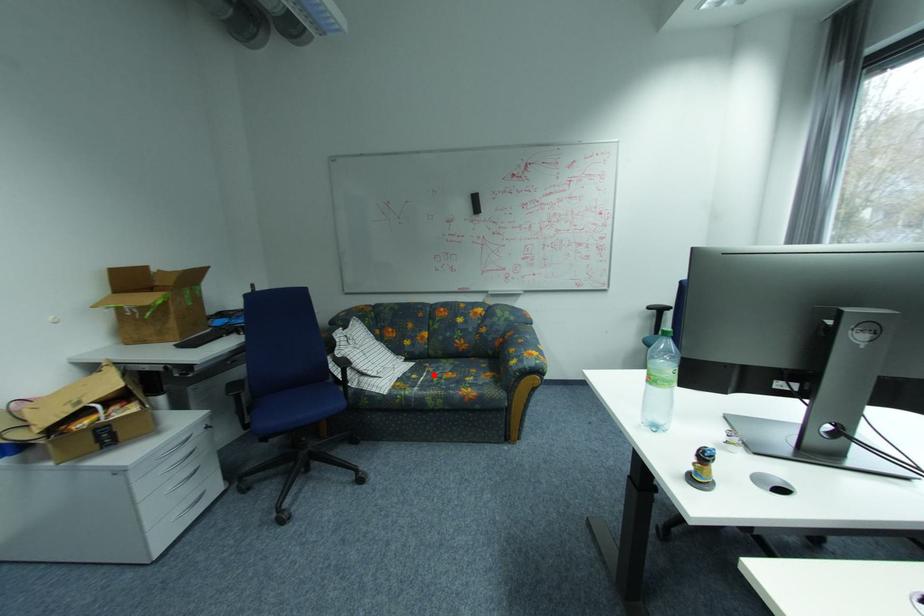
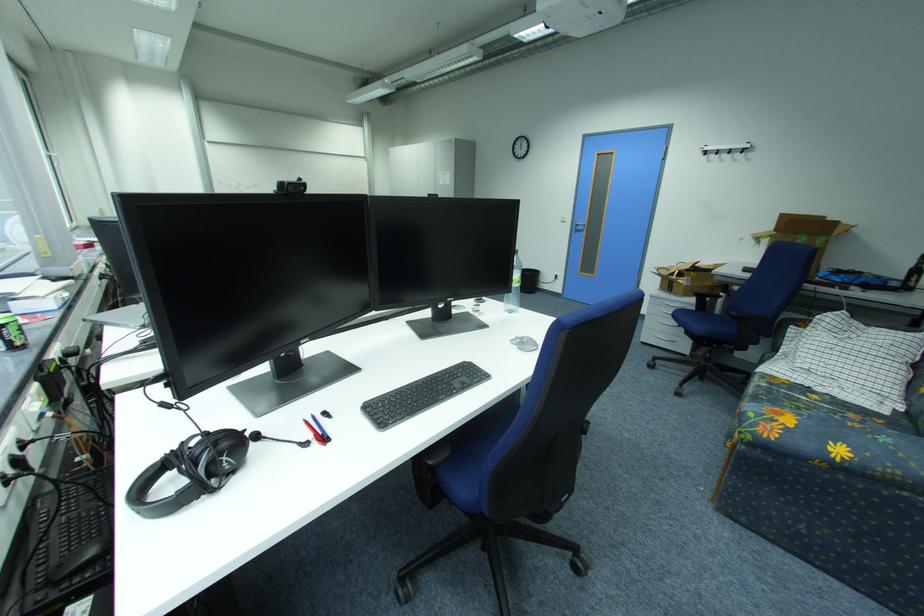
Where in the second image is the point corresponding to the highlighted location from the first image?

(834, 407)